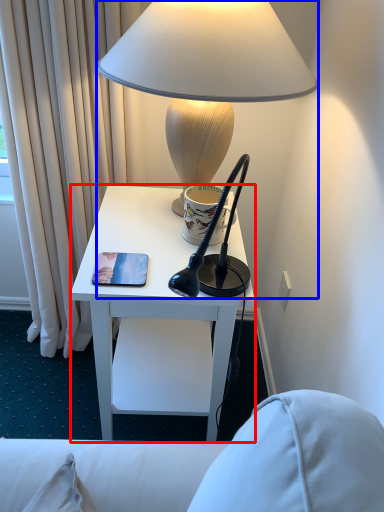
Question: Among these objects, which one is farthest to the camera, desk (highlighted by a red box) or lamp (highlighted by a blue box)?

Choices:
 (A) desk
 (B) lamp

Answer: (A)